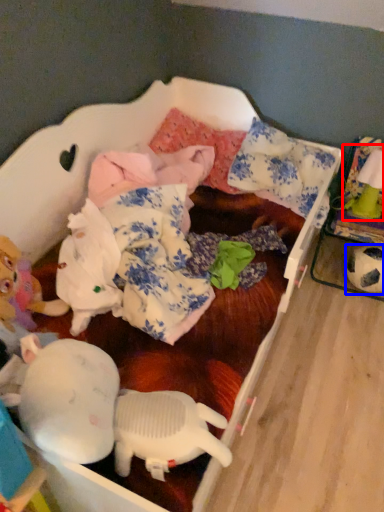
Question: Which point is closer to the camera, toy (highlighted by a red box) or toy (highlighted by a blue box)?

Choices:
 (A) toy
 (B) toy

Answer: (A)